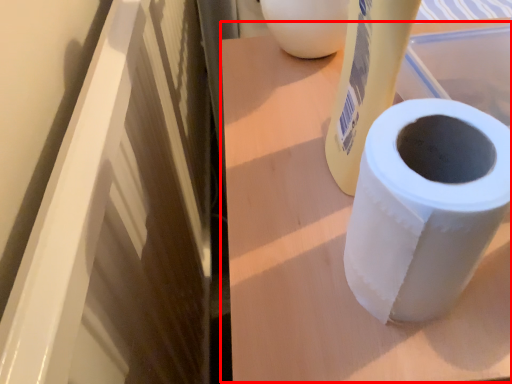
Question: In this image, where is table (annotated by the red box) located relative to toilet paper?

Choices:
 (A) right
 (B) left

Answer: (A)